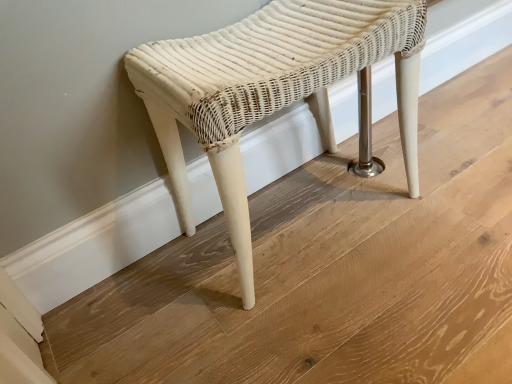
Find the location of `free space in front of white wicker stool at center`. free space in front of white wicker stool at center is located at coordinates (345, 315).